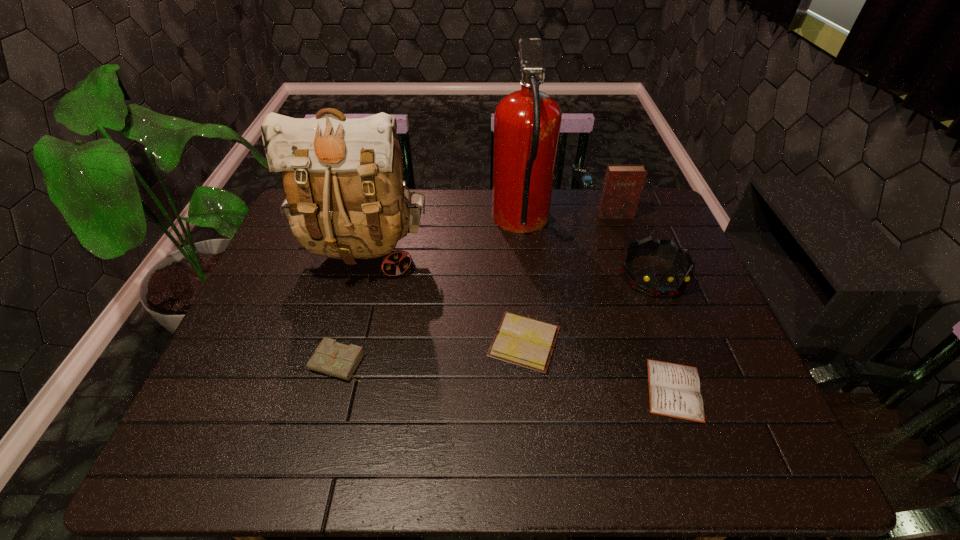
I want to click on vacant area between the fire extinguisher and the fifth tallest object, so click(x=430, y=293).

At what (x,y) coordinates should I click in order to perform the action: click on vacant area that lies between the second tallest object and the fourth shortest object. Please return your answer as a coordinate pair (x, y). The width and height of the screenshot is (960, 540). Looking at the image, I should click on (509, 264).

Find the location of a particular element. free point between the tallest diary and the second tallest object is located at coordinates (490, 234).

The image size is (960, 540). Find the location of `vacant region between the second shortest object and the second tallest object`. vacant region between the second shortest object and the second tallest object is located at coordinates (444, 298).

Image resolution: width=960 pixels, height=540 pixels. I want to click on empty location between the tiara and the fire extinguisher, so click(x=588, y=249).

The height and width of the screenshot is (540, 960). I want to click on free space between the fourth shortest object and the leftmost diary, so click(x=496, y=319).

Identify the location of vacant area that lies between the backpack and the fire extinguisher. (443, 238).

Identify the location of free space that is in between the second tallest diary and the second tallest object. (352, 308).

The width and height of the screenshot is (960, 540). I want to click on empty space that is in between the fire extinguisher and the third tallest object, so click(568, 219).

Identify which object is the fifth nearest to the fire extinguisher. Please provide its 2D coordinates. Your answer should be formatted as a tuple, i.e. [(x, y)], where the tuple contains the x and y coordinates of a point satisfying the conditions above.

[(674, 390)]